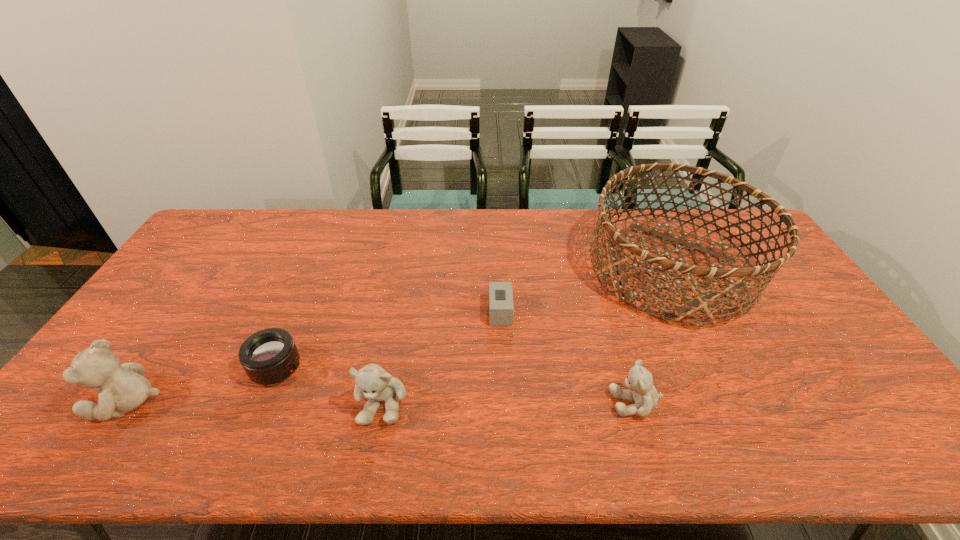
At what (x,y) coordinates should I click in order to perform the action: click on the leftmost teddy bear. Please return your answer as a coordinate pair (x, y). The height and width of the screenshot is (540, 960). Looking at the image, I should click on (122, 388).

Where is `the third tallest object`? the third tallest object is located at coordinates click(x=372, y=381).

Where is `the second teddy bear from right to left`? the second teddy bear from right to left is located at coordinates (372, 381).

Identify the location of the fourth tallest object. The image size is (960, 540). (641, 390).

Image resolution: width=960 pixels, height=540 pixels. I want to click on the rightmost teddy bear, so 641,390.

You are a GUI agent. You are given a task and a screenshot of the screen. Output one action in this format:
    pyautogui.click(x=<x>, y=<y>)
    Task: Click on the tallest object
    This screenshot has height=540, width=960.
    Given the screenshot: What is the action you would take?
    pyautogui.click(x=702, y=297)

Identify the location of the third object from right to left. (501, 309).

The width and height of the screenshot is (960, 540). Identify the location of alarm clock. (501, 309).

Identify the location of the fifth tallest object. (269, 356).

Where is `the second object from left to right`? The height and width of the screenshot is (540, 960). the second object from left to right is located at coordinates (269, 356).